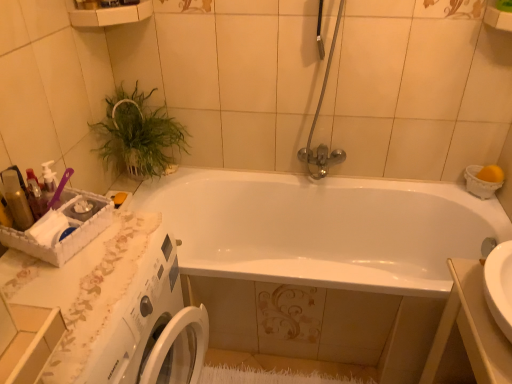
You are a GUI agent. You are given a task and a screenshot of the screen. Output one action in this format:
    pyautogui.click(x=<x>, y=<y>)
    Task: Click on the free location in front of shiny plastic bottles at left
    
    Given the screenshot: What is the action you would take?
    pyautogui.click(x=29, y=274)